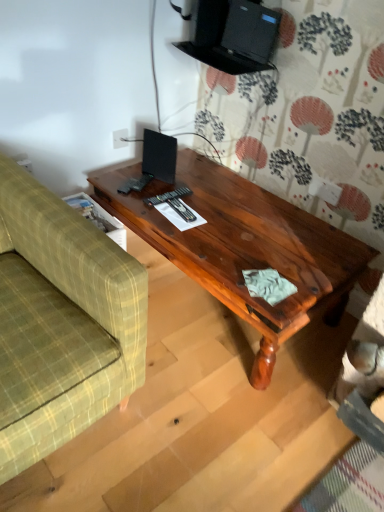
The height and width of the screenshot is (512, 384). Find the location of `vacant area on top of shiny brown wood coffee table at center (from a real-world perspective)`. vacant area on top of shiny brown wood coffee table at center (from a real-world perspective) is located at coordinates (231, 211).